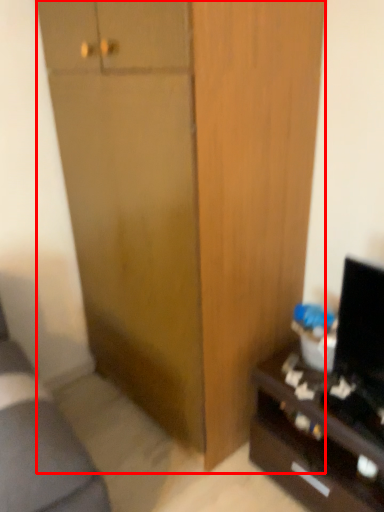
Question: From the image's perspective, what is the correct spatial positioning of cabinetry (annotated by the red box) in reference to desk?

Choices:
 (A) below
 (B) above

Answer: (B)